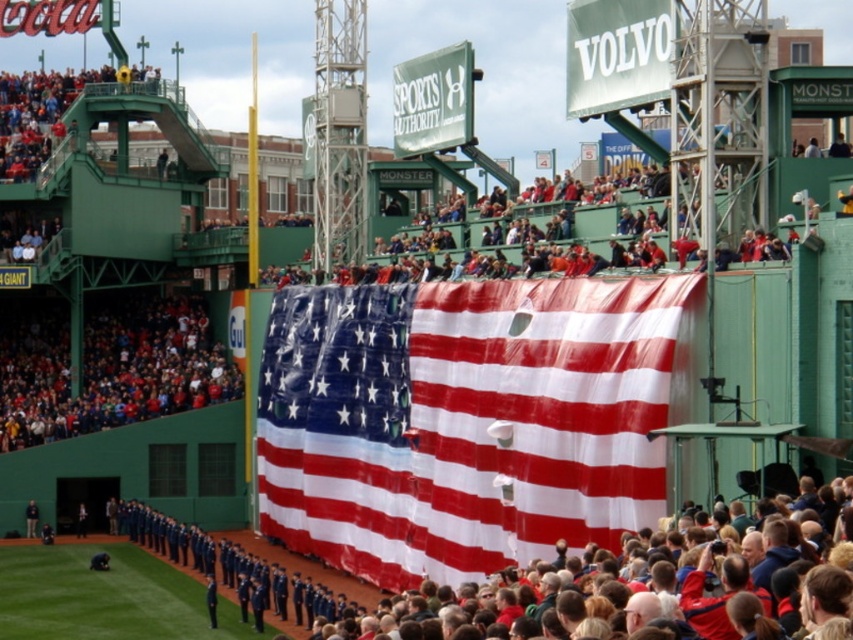
Question: Can you confirm if polyester american flag at center is thinner than dark blue uniform at lower left?

Choices:
 (A) no
 (B) yes

Answer: (A)

Question: Is polyester american flag at center below dark blue uniform at lower left?

Choices:
 (A) no
 (B) yes

Answer: (A)

Question: Which object appears closest to the camera in this image?

Choices:
 (A) dark blue uniform at lower left
 (B) polyester american flag at center

Answer: (B)

Question: Does polyester american flag at center appear over dark blue uniform at lower left?

Choices:
 (A) no
 (B) yes

Answer: (B)

Question: Among these objects, which one is farthest from the camera?

Choices:
 (A) polyester american flag at center
 (B) dark blue uniform at lower left

Answer: (B)